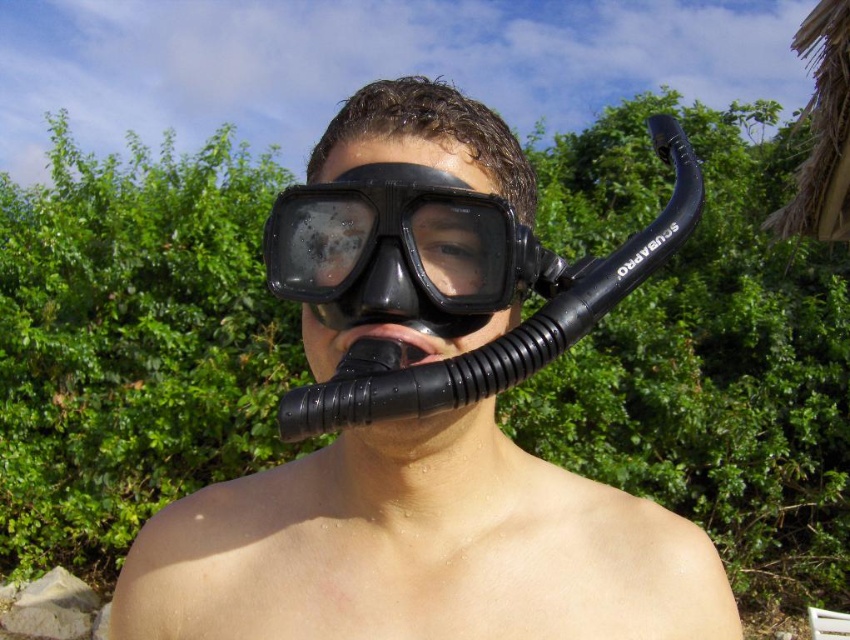
You are a lifeguard checking the equipment of a diver. You notice the black rubber snorkel at center and the black matte snorkel mask at center. Which piece of equipment has a larger size?

The black rubber snorkel at center is bigger than the black matte snorkel mask at center, so the black rubber snorkel at center is the larger one.

You are a lifeguard checking the safety equipment. You have to place both the black matte snorkel at center and the black matte snorkel mask at center into a storage box. The box can only fit items up to the size of the snorkel mask. Will both items fit?

The black matte snorkel at center is larger in size than the black matte snorkel mask at center. Since the storage box can only fit items up to the size of the snorkel mask, the snorkel will not fit inside the box.

You are navigating a drone through the scene. There are two points marked in the image at coordinates point (667, 141) and point (452, 218). Which point is closer to the front of the scene?

Point (452, 218) is closer to the front of the scene because it is in front of point (667, 141).